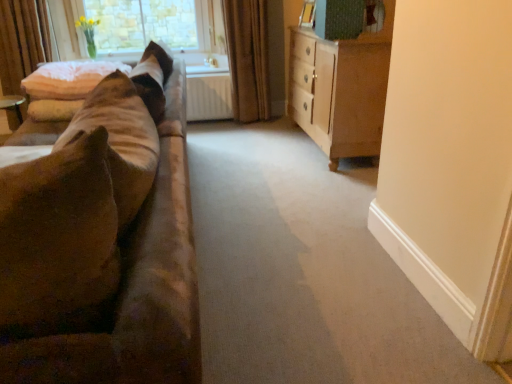
Question: From a real-world perspective, relative to clear glass window at upper left, is light brown wood dresser at right vertically above or below?

Choices:
 (A) above
 (B) below

Answer: (B)

Question: From the image's perspective, is light brown wood dresser at right located above or below clear glass window at upper left?

Choices:
 (A) below
 (B) above

Answer: (A)

Question: Estimate the real-world distances between objects in this image. Which object is farther from the white fluffy pillow at upper left?

Choices:
 (A) clear glass window at upper left
 (B) light brown wood dresser at right
 (C) suede-like brown couch at left
 (D) brown textured curtain at center

Answer: (C)

Question: Which object is positioned closest to the suede-like brown couch at left?

Choices:
 (A) white fluffy pillow at upper left
 (B) light brown wood dresser at right
 (C) clear glass window at upper left
 (D) brown textured curtain at center

Answer: (A)